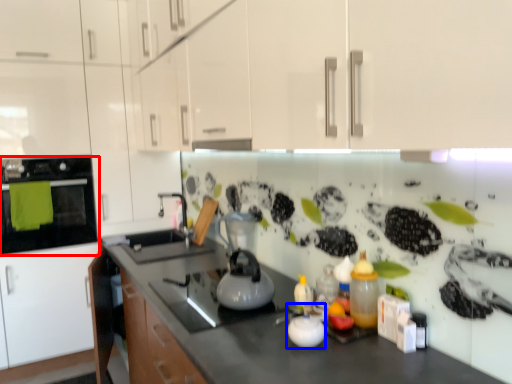
Question: Which point is closer to the camera, home appliance (highlighted by a red box) or appliance (highlighted by a blue box)?

Choices:
 (A) home appliance
 (B) appliance

Answer: (B)